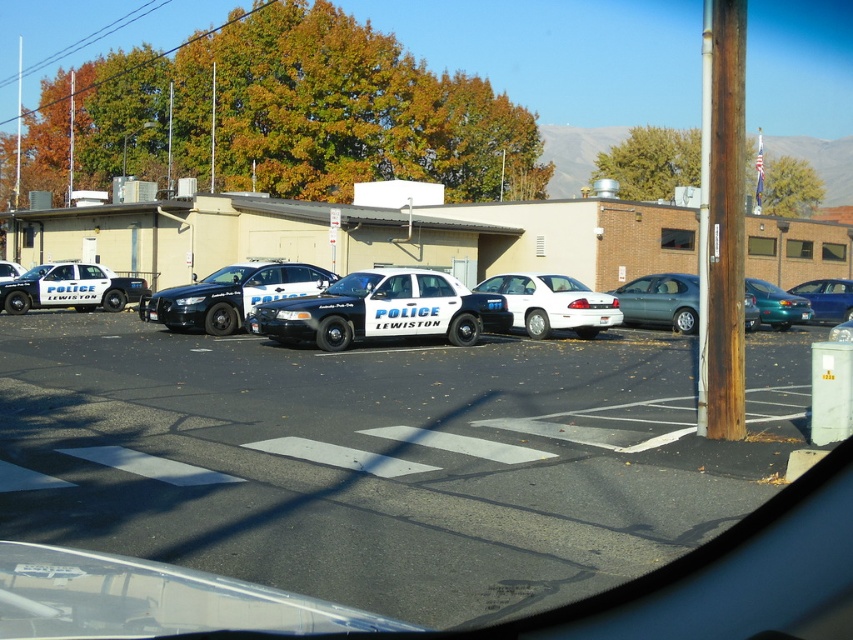
Locate an element on the screen. Image resolution: width=853 pixels, height=640 pixels. white glossy sedan at center is located at coordinates (553, 304).

Does white glossy sedan at center appear on the left side of teal metallic sedan at right?

Indeed, white glossy sedan at center is positioned on the left side of teal metallic sedan at right.

Between point (590, 332) and point (785, 316), which one is positioned behind?

The point (785, 316) is behind.

The image size is (853, 640). What are the coordinates of `white glossy sedan at center` in the screenshot? It's located at (553, 304).

Is white glossy sedan at center shorter than metallic blue sedan at right?

In fact, white glossy sedan at center may be taller than metallic blue sedan at right.

Is white glossy sedan at center to the left of metallic blue sedan at right from the viewer's perspective?

Correct, you'll find white glossy sedan at center to the left of metallic blue sedan at right.

Is point (570, 300) positioned in front of point (840, 280)?

Yes.

Locate an element on the screen. The width and height of the screenshot is (853, 640). white glossy sedan at center is located at coordinates (553, 304).

Can you confirm if matte black police car at left is positioned above teal metallic sedan at right?

Yes, matte black police car at left is above teal metallic sedan at right.

Consider the image. Does matte black police car at left appear on the right side of teal metallic sedan at right?

No, matte black police car at left is not to the right of teal metallic sedan at right.

Consider the image. Who is more forward, (x=59, y=298) or (x=787, y=328)?

Point (x=787, y=328)

At what (x,y) coordinates should I click in order to perform the action: click on matte black police car at left. Please return your answer as a coordinate pair (x, y). This screenshot has height=640, width=853. Looking at the image, I should click on (70, 289).